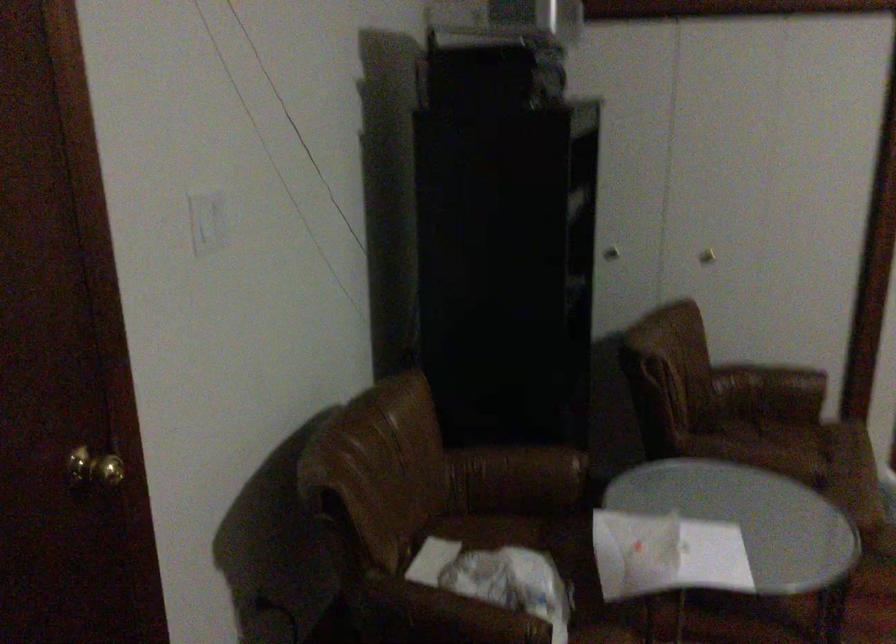
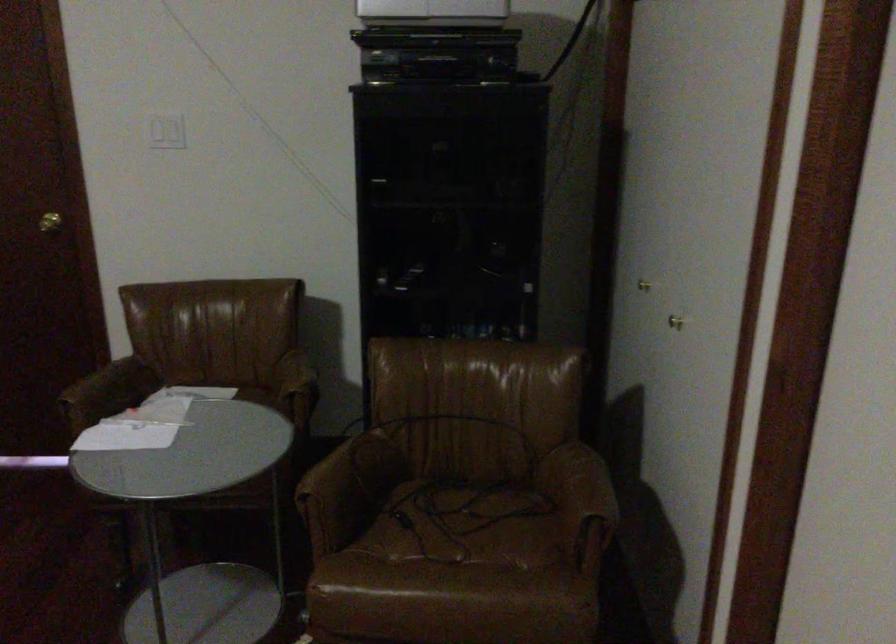
Locate, in the second image, the point that corresponds to (x=152, y=466) in the first image.

(49, 222)